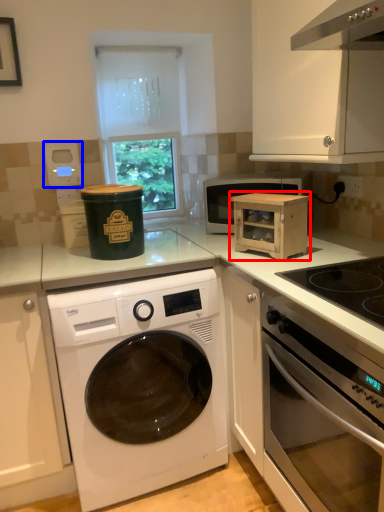
Question: Among these objects, which one is nearest to the camera, cardboard box (highlighted by a red box) or appliance (highlighted by a blue box)?

Choices:
 (A) cardboard box
 (B) appliance

Answer: (A)